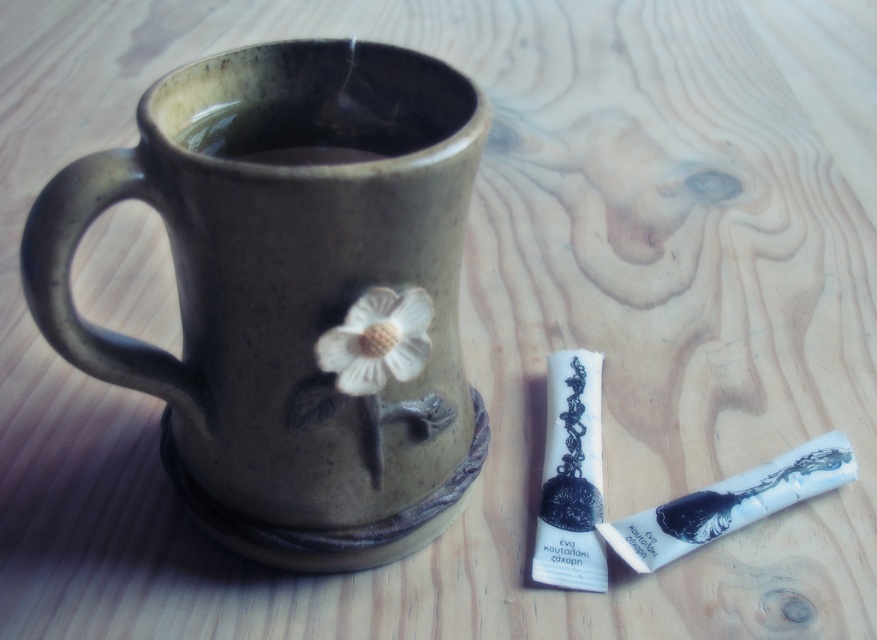
Does matte ceramic mug at center appear on the right side of white matte flower at center?

No, matte ceramic mug at center is not to the right of white matte flower at center.

Is point (283, 404) behind point (398, 356)?

Yes, it is behind point (398, 356).

The image size is (877, 640). Identify the location of matte ceramic mug at center. (294, 292).

Which is in front, point (353, 509) or point (351, 161)?

Positioned in front is point (353, 509).

Measure the distance between point (x=252, y=294) and camera.

A distance of 33.81 inches exists between point (x=252, y=294) and camera.

Where is `matte ceramic mug at center`? matte ceramic mug at center is located at coordinates (294, 292).

Looking at this image, between brown matte tea at upper center and white matte flower at center, which one has less height?

With less height is brown matte tea at upper center.

Find the location of `brown matte tea at upper center`. brown matte tea at upper center is located at coordinates (305, 132).